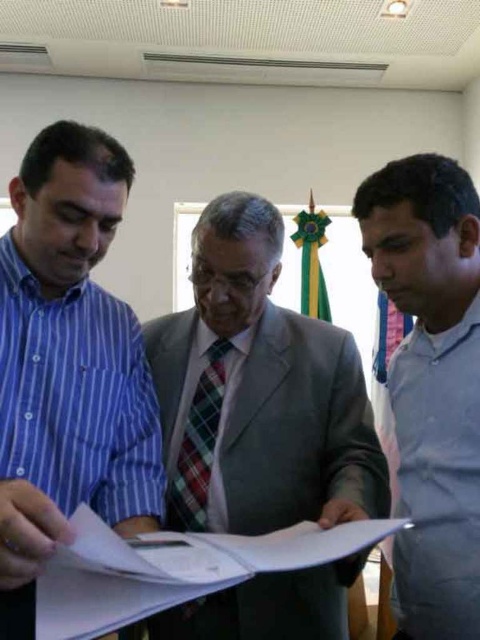
Question: Which is nearer to the gray smooth shirt at right?

Choices:
 (A) plaid fabric tie at center
 (B) gray suit at center
 (C) blue striped shirt at left

Answer: (B)

Question: Can you confirm if blue striped shirt at left is positioned to the left of plaid fabric tie at center?

Choices:
 (A) no
 (B) yes

Answer: (B)

Question: Which object is positioned closest to the blue striped shirt at left?

Choices:
 (A) gray suit at center
 (B) plaid fabric tie at center
 (C) white paper at center

Answer: (A)

Question: Is gray suit at center wider than gray smooth shirt at right?

Choices:
 (A) yes
 (B) no

Answer: (A)

Question: Based on their relative distances, which object is farther from the plaid fabric tie at center?

Choices:
 (A) gray suit at center
 (B) gray smooth shirt at right

Answer: (B)

Question: Can you confirm if blue striped shirt at left is positioned to the right of plaid fabric tie at center?

Choices:
 (A) yes
 (B) no

Answer: (B)